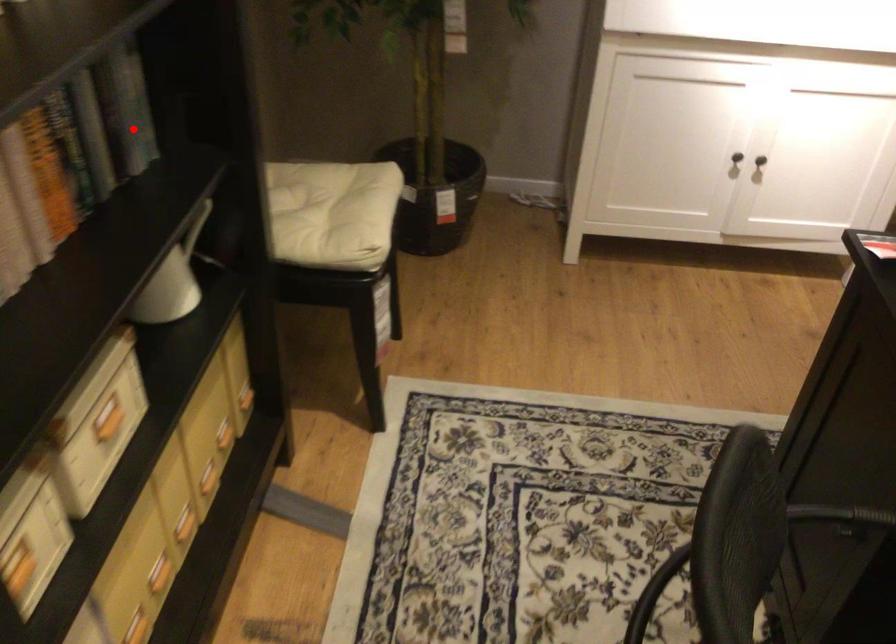
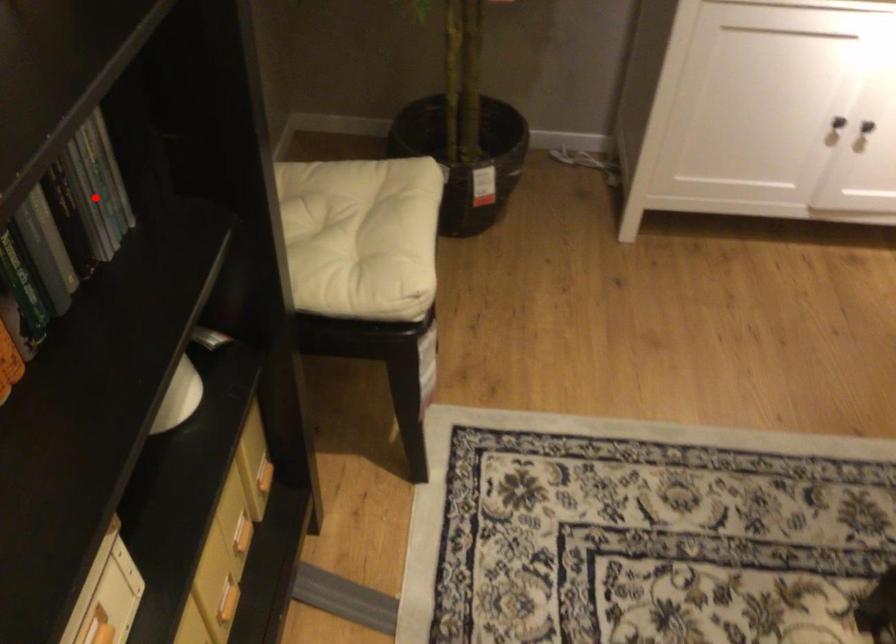
I am providing you with two images of the same scene from different viewpoints. A red point is marked on the first image and another point is marked on the second image. Do the highlighted points in image1 and image2 indicate the same real-world spot?

Yes